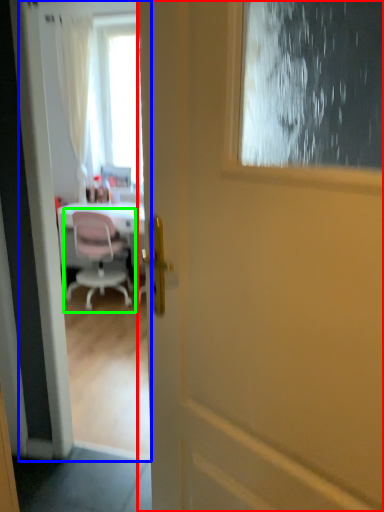
Question: Estimate the real-world distances between objects in this image. Which object is farther from door (highlighted by a red box), screen door (highlighted by a blue box) or chair (highlighted by a green box)?

Choices:
 (A) screen door
 (B) chair

Answer: (B)